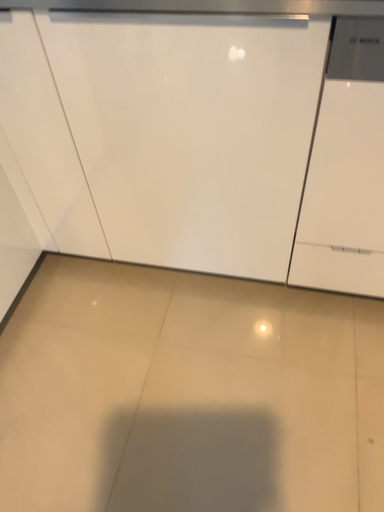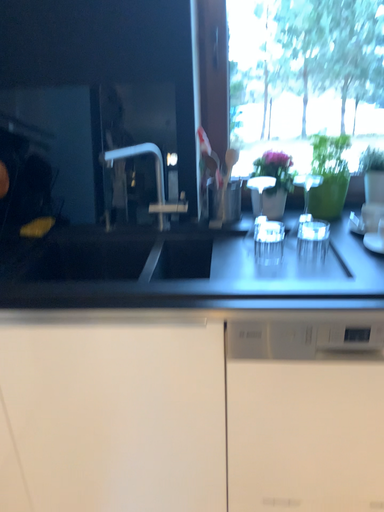
Question: Which way did the camera rotate in the video?

Choices:
 (A) rotated upward
 (B) rotated downward

Answer: (A)